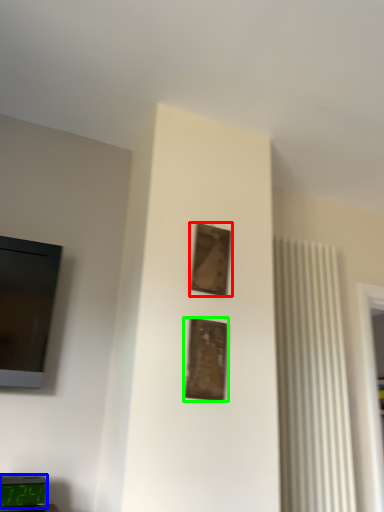
Question: Estimate the real-world distances between objects in this image. Which object is farther from picture frame (highlighted by a red box), alarm clock (highlighted by a blue box) or picture frame (highlighted by a green box)?

Choices:
 (A) alarm clock
 (B) picture frame

Answer: (A)